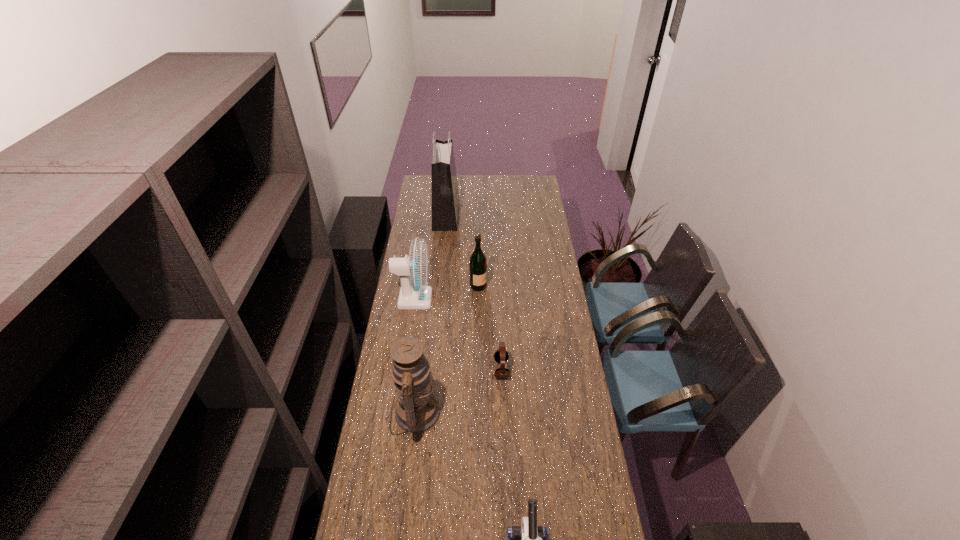
In the image, there is a desktop. At what (x,y) coordinates should I click in order to perform the action: click on blank space at the right edge. Please return your answer as a coordinate pair (x, y). Looking at the image, I should click on (536, 235).

In the image, there is a desktop. Where is `vacant space at the far right corner`? Image resolution: width=960 pixels, height=540 pixels. vacant space at the far right corner is located at coordinates (537, 187).

The height and width of the screenshot is (540, 960). Identify the location of vacant area between the third object from right to left and the headset. (490, 328).

The image size is (960, 540). Find the location of `free space between the fan and the shortest object`. free space between the fan and the shortest object is located at coordinates (458, 334).

The width and height of the screenshot is (960, 540). Find the location of `vacant area that lies between the fifth shortest object and the fourth object from left to right`. vacant area that lies between the fifth shortest object and the fourth object from left to right is located at coordinates (446, 349).

Locate an element on the screen. The height and width of the screenshot is (540, 960). unoccupied position between the third object from right to left and the shortest object is located at coordinates pos(490,328).

I want to click on free space between the fourth farthest object and the second nearest object, so click(458, 391).

Identify which object is the fourth nearest to the second nearest object. Please provide its 2D coordinates. Your answer should be formatted as a tuple, i.e. [(x, y)], where the tuple contains the x and y coordinates of a point satisfying the conditions above.

[(478, 264)]

Locate which object is the fifth closest to the shortest object. Please provide its 2D coordinates. Your answer should be formatted as a tuple, i.e. [(x, y)], where the tuple contains the x and y coordinates of a point satisfying the conditions above.

[(445, 196)]

This screenshot has height=540, width=960. Find the location of `free spot that satisfies the following two spatial constraints: 1. in front of the fan to face the airflow; 2. on the back side of the oil lamp`. free spot that satisfies the following two spatial constraints: 1. in front of the fan to face the airflow; 2. on the back side of the oil lamp is located at coordinates (397, 413).